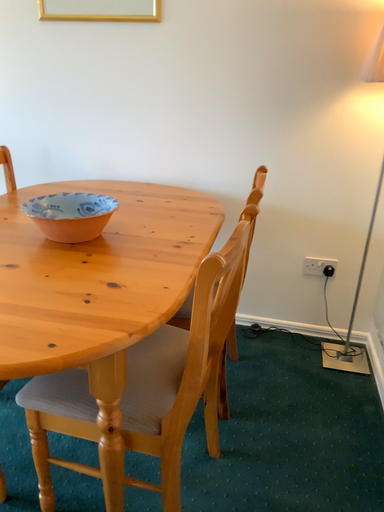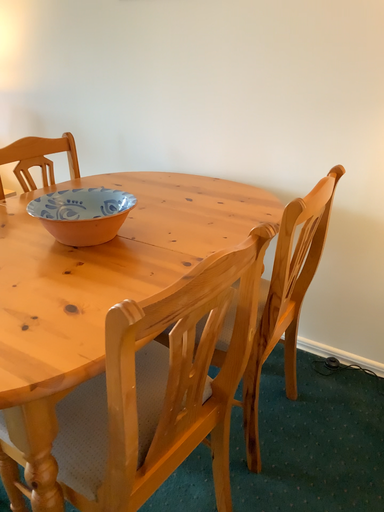
Question: Which way did the camera rotate in the video?

Choices:
 (A) rotated right
 (B) rotated left

Answer: (B)